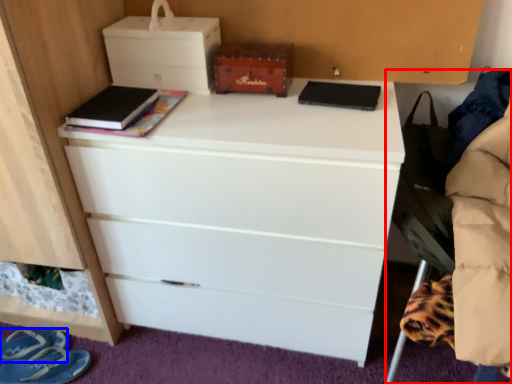
Question: Which of the following is the closest to the observer, swivel chair (highlighted by a red box) or footwear (highlighted by a blue box)?

Choices:
 (A) swivel chair
 (B) footwear

Answer: (A)